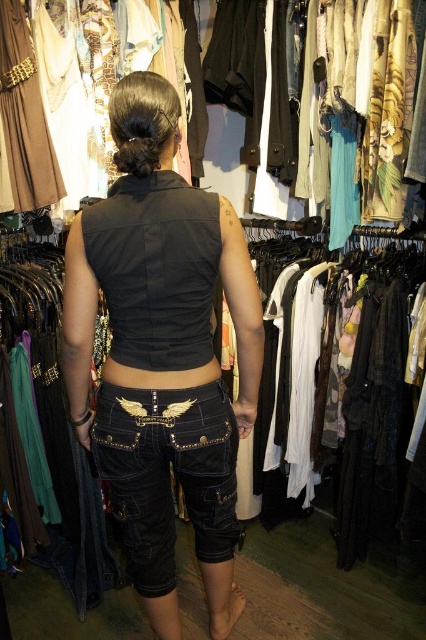
You are a customer in the clothing store and want to try on the black leather belt at center and the denim shorts at center. However, you can only reach one of them first. Which item can you grab first without moving the other?

The black leather belt at center is behind the denim shorts at center, so you can grab the denim shorts at center first without moving the belt.

In the scene shown: You are a fashion designer who wants to place a new decorative patch on the denim shorts at center. The patch is 2 feet wide. Can you fit it on the front pockets without overlapping the existing metallic emblem?

The denim shorts at center have a metallic emblem on the front pockets. The existing emblem is 3.94 feet apart from the patch, so there is enough space to place the new 2 feet wide patch without overlapping.